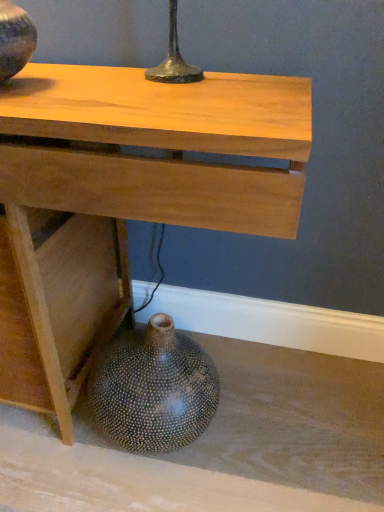
This screenshot has width=384, height=512. In order to click on vacant area to the left of speckled ceramic vase at lower left, the 1th vase when ordered from right to left in this screenshot , I will do `click(43, 455)`.